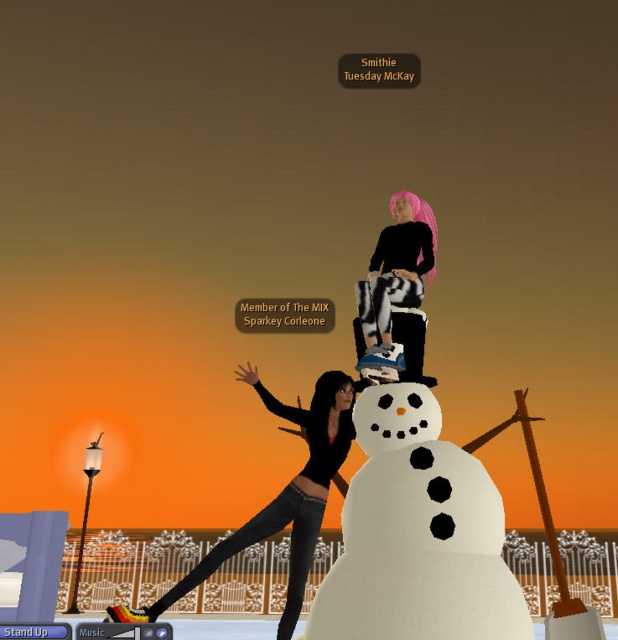
Question: Is white fluffy snowman at center thinner than black matte pants at center?

Choices:
 (A) yes
 (B) no

Answer: (A)

Question: Does white fluffy snowman at center appear over black matte pants at center?

Choices:
 (A) yes
 (B) no

Answer: (A)

Question: Which point is farther to the camera?

Choices:
 (A) (350, 547)
 (B) (316, 497)
 (C) (376, 332)

Answer: (C)

Question: Where is white fluffy snowman at center located in relation to black matte pants at center in the image?

Choices:
 (A) below
 (B) above

Answer: (B)

Question: Based on their relative distances, which object is farther from the white fluffy snowman at center?

Choices:
 (A) black matte pants at center
 (B) zebra-patterned pants at upper center

Answer: (B)

Question: Which object appears farthest from the camera in this image?

Choices:
 (A) white fluffy snowman at center
 (B) zebra-patterned pants at upper center

Answer: (B)